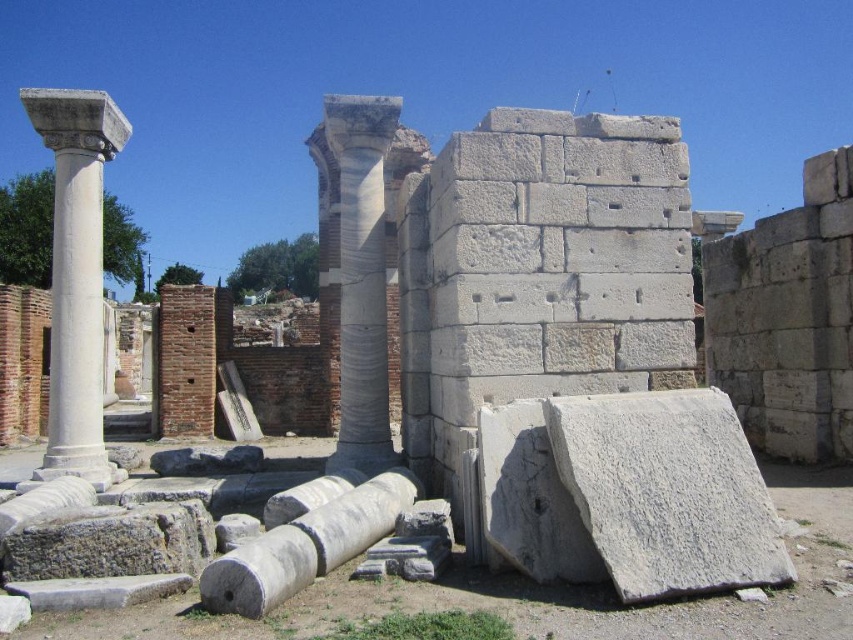
Question: Does white marble column at left come in front of white marble column at center?

Choices:
 (A) no
 (B) yes

Answer: (B)

Question: Does white marble column at left lie in front of white marble column at center?

Choices:
 (A) no
 (B) yes

Answer: (B)

Question: In this image, where is white marble column at left located relative to white marble column at center?

Choices:
 (A) above
 (B) below

Answer: (A)

Question: Which object is closer to the camera taking this photo?

Choices:
 (A) white marble column at center
 (B) white marble column at left

Answer: (B)